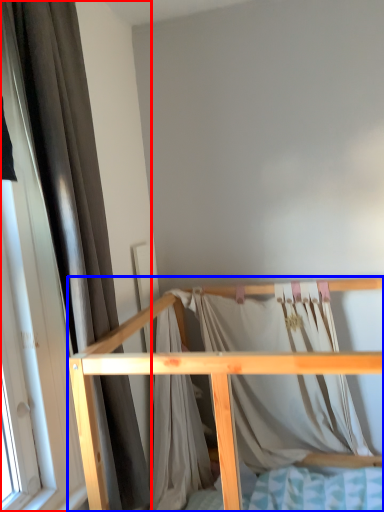
Question: Among these objects, which one is farthest to the camera, curtain (highlighted by a red box) or furniture (highlighted by a blue box)?

Choices:
 (A) curtain
 (B) furniture

Answer: (A)